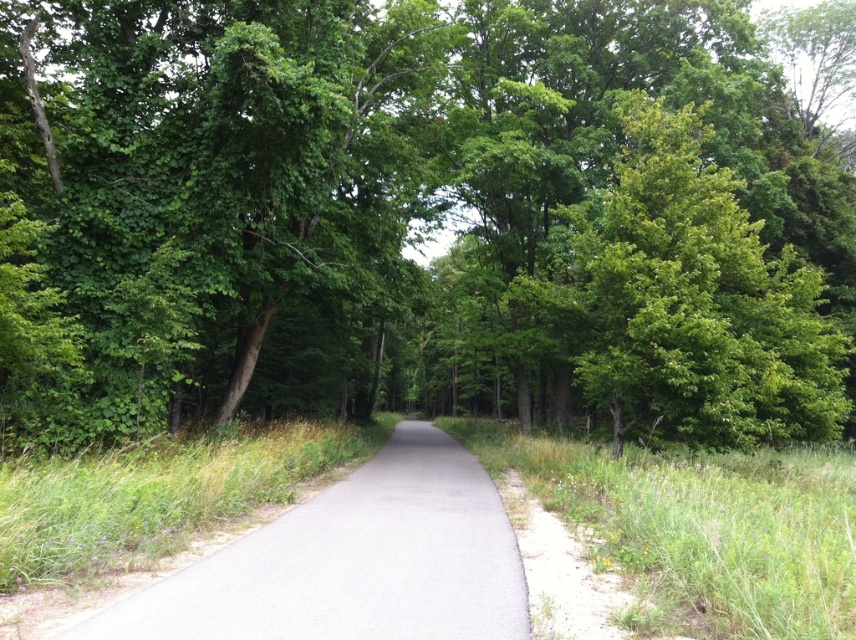
Question: Considering the real-world distances, which object is farthest from the gray asphalt path at center?

Choices:
 (A) green leafy tree at center
 (B) green grass at right

Answer: (A)

Question: Can you confirm if green leafy tree at center is positioned below gray asphalt path at center?

Choices:
 (A) no
 (B) yes

Answer: (A)

Question: Considering the real-world distances, which object is farthest from the green grass at right?

Choices:
 (A) green leafy tree at center
 (B) gray asphalt path at center

Answer: (A)

Question: Does green leafy tree at center appear on the left side of gray asphalt path at center?

Choices:
 (A) no
 (B) yes

Answer: (A)

Question: Considering the relative positions of gray asphalt path at center and green grass at right in the image provided, where is gray asphalt path at center located with respect to green grass at right?

Choices:
 (A) below
 (B) above

Answer: (A)

Question: Which of the following is the farthest from the observer?

Choices:
 (A) (507, 65)
 (B) (740, 515)

Answer: (A)